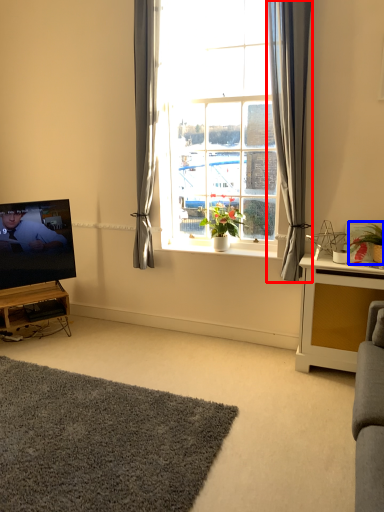
Question: Which point is closer to the camera, curtain (highlighted by a red box) or houseplant (highlighted by a blue box)?

Choices:
 (A) curtain
 (B) houseplant

Answer: (A)